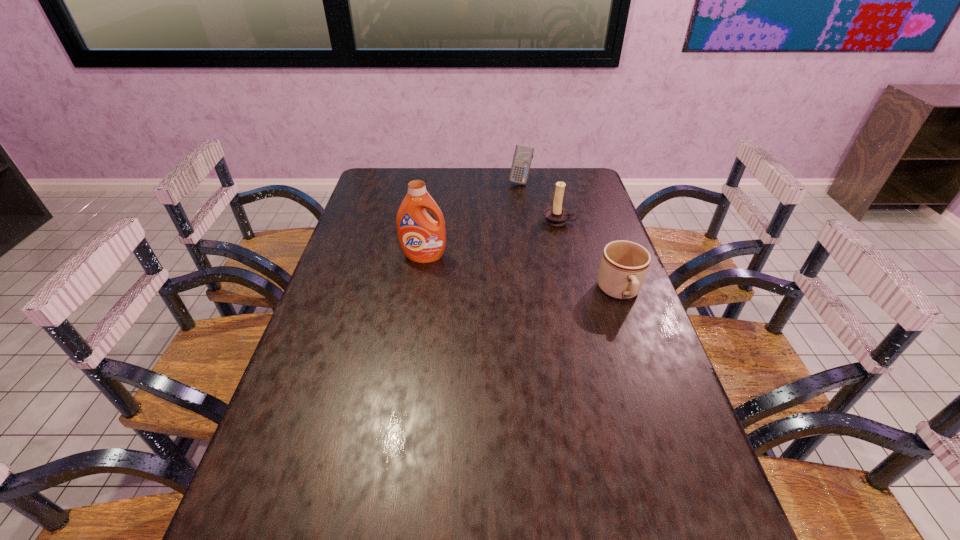
At what (x,y) coordinates should I click in order to perform the action: click on free region located 0.290m on the wick of the candle holder. Please return your answer as a coordinate pair (x, y). The height and width of the screenshot is (540, 960). Looking at the image, I should click on (537, 281).

The width and height of the screenshot is (960, 540). What are the coordinates of `vacant region located on the wick of the candle holder` in the screenshot? It's located at (540, 268).

Locate an element on the screen. The image size is (960, 540). free space located on the wick of the candle holder is located at coordinates (548, 248).

You are a GUI agent. You are given a task and a screenshot of the screen. Output one action in this format:
    pyautogui.click(x=<x>, y=<y>)
    Task: Click on the free space located on the front-facing side of the calculator
    The height and width of the screenshot is (540, 960).
    Given the screenshot: What is the action you would take?
    pyautogui.click(x=512, y=214)

Where is `vacant position located 0.330m on the front-facing side of the calculator`? The image size is (960, 540). vacant position located 0.330m on the front-facing side of the calculator is located at coordinates (507, 235).

You are a GUI agent. You are given a task and a screenshot of the screen. Output one action in this format:
    pyautogui.click(x=<x>, y=<y>)
    Task: Click on the blank space located 0.390m on the front-facing side of the calculator
    
    Given the screenshot: What is the action you would take?
    pyautogui.click(x=504, y=246)

This screenshot has height=540, width=960. Identify the location of object that is at the far edge. (523, 155).

Identify the location of mug that is at the right edge. (624, 264).

The height and width of the screenshot is (540, 960). I want to click on candle holder that is at the right edge, so click(x=557, y=215).

At what (x,y) coordinates should I click in order to perform the action: click on blank space at the far edge of the desktop. Please return your answer as a coordinate pair (x, y). This screenshot has height=540, width=960. Looking at the image, I should click on (538, 176).